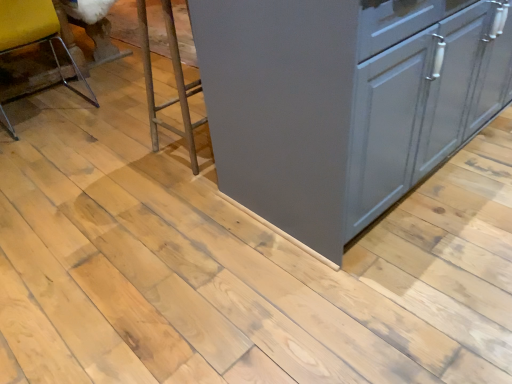
In order to click on clear plastic chair at left in this screenshot , I will do 34,30.

Find the location of a particular element. Image resolution: width=512 pixels, height=384 pixels. metallic silver step stool at center is located at coordinates (175, 80).

This screenshot has height=384, width=512. I want to click on clear plastic chair at left, so 34,30.

Is metallic silver step stool at center oriented away from clear plastic chair at left?

Absolutely, metallic silver step stool at center is directed away from clear plastic chair at left.

From the image's perspective, which is above, metallic silver step stool at center or clear plastic chair at left?

clear plastic chair at left, from the image's perspective.

Who is bigger, metallic silver step stool at center or clear plastic chair at left?

clear plastic chair at left is bigger.

You are a GUI agent. You are given a task and a screenshot of the screen. Output one action in this format:
    pyautogui.click(x=<x>, y=<y>)
    Task: Click on the step stool in front of the clear plastic chair at left
    The width and height of the screenshot is (512, 384).
    Given the screenshot: What is the action you would take?
    pyautogui.click(x=175, y=80)

Considering the points (179, 60) and (426, 63), which point is in front, point (179, 60) or point (426, 63)?

Point (426, 63)

What's the angular difference between metallic silver step stool at center and satin gray cabinet at center's facing directions?

The angle between the facing direction of metallic silver step stool at center and the facing direction of satin gray cabinet at center is 179 degrees.

Considering the positions of objects metallic silver step stool at center and satin gray cabinet at center in the image provided, who is behind, metallic silver step stool at center or satin gray cabinet at center?

metallic silver step stool at center is behind.

How distant is metallic silver step stool at center from satin gray cabinet at center?

They are 24.72 inches apart.

From a real-world perspective, is satin gray cabinet at center above or below clear plastic chair at left?

From a real-world perspective, satin gray cabinet at center is physically above clear plastic chair at left.

Considering the positions of objects satin gray cabinet at center and clear plastic chair at left in the image provided, who is in front, satin gray cabinet at center or clear plastic chair at left?

satin gray cabinet at center is in front.

Identify the location of cabinetry in front of the clear plastic chair at left. The width and height of the screenshot is (512, 384). (343, 101).

From the image's perspective, is satin gray cabinet at center on clear plastic chair at left?

→ Actually, satin gray cabinet at center appears below clear plastic chair at left in the image.

At what (x,y) coordinates should I click in order to perform the action: click on cabinetry that is below the clear plastic chair at left (from the image's perspective). Please return your answer as a coordinate pair (x, y). Looking at the image, I should click on (343, 101).

How many degrees apart are the facing directions of clear plastic chair at left and satin gray cabinet at center?

They differ by 1.12 degrees in their facing directions.

From their relative heights in the image, would you say clear plastic chair at left is taller or shorter than satin gray cabinet at center?

Considering their sizes, clear plastic chair at left has less height than satin gray cabinet at center.

From the image's perspective, which object appears higher, clear plastic chair at left or satin gray cabinet at center?

From the image's view, clear plastic chair at left is above.

Considering their positions, is satin gray cabinet at center located in front of or behind metallic silver step stool at center?

satin gray cabinet at center is positioned closer to the viewer than metallic silver step stool at center.

Does satin gray cabinet at center touch metallic silver step stool at center?

No, satin gray cabinet at center is not making contact with metallic silver step stool at center.

From a real-world perspective, who is located lower, satin gray cabinet at center or metallic silver step stool at center?

In real-world perspective, metallic silver step stool at center is lower.

Measure the distance from satin gray cabinet at center to metallic silver step stool at center.

satin gray cabinet at center and metallic silver step stool at center are 24.72 inches apart from each other.

Which is closer to the camera, (10, 3) or (143, 68)?

Point (10, 3).

From the image's perspective, is clear plastic chair at left located above metallic silver step stool at center?

Yes, from the image's perspective, clear plastic chair at left is over metallic silver step stool at center.

Is clear plastic chair at left not close to metallic silver step stool at center?

No, clear plastic chair at left is not far from metallic silver step stool at center.

Is clear plastic chair at left oriented towards metallic silver step stool at center?

No, clear plastic chair at left is not aimed at metallic silver step stool at center.

Identify the location of chair on the left of metallic silver step stool at center. (34, 30).

Identify the location of step stool behind the satin gray cabinet at center. The width and height of the screenshot is (512, 384). (175, 80).

Consider the image. Considering their positions, is metallic silver step stool at center positioned further to clear plastic chair at left than satin gray cabinet at center?

Among the two, satin gray cabinet at center is located further to clear plastic chair at left.

Based on their spatial positions, is clear plastic chair at left or metallic silver step stool at center further from satin gray cabinet at center?

clear plastic chair at left lies further to satin gray cabinet at center than the other object.

Estimate the real-world distances between objects in this image. Which object is further from metallic silver step stool at center, clear plastic chair at left or satin gray cabinet at center?

Among the two, clear plastic chair at left is located further to metallic silver step stool at center.

Estimate the real-world distances between objects in this image. Which object is further from metallic silver step stool at center, satin gray cabinet at center or clear plastic chair at left?

clear plastic chair at left lies further to metallic silver step stool at center than the other object.

Which object lies further to the anchor point clear plastic chair at left, satin gray cabinet at center or metallic silver step stool at center?

satin gray cabinet at center is further to clear plastic chair at left.

Based on the photo, looking at the image, which one is located further to satin gray cabinet at center, metallic silver step stool at center or clear plastic chair at left?

clear plastic chair at left is further to satin gray cabinet at center.

At what (x,y) coordinates should I click in order to perform the action: click on step stool between clear plastic chair at left and satin gray cabinet at center. Please return your answer as a coordinate pair (x, y). Looking at the image, I should click on (175, 80).